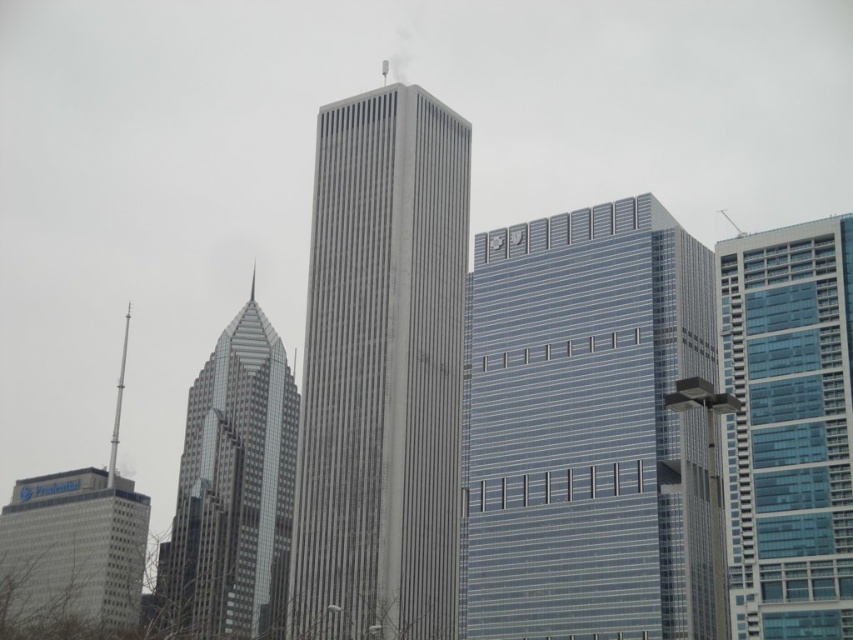
You are a drone operator who needs to fly a drone between the glassy silver skyscraper at left and the gray concrete building at lower left. The drone has a wingspan of 1.2 meters. Can the drone safely navigate the space between them?

The distance between the glassy silver skyscraper at left and the gray concrete building at lower left is 15.00 meters, which is more than enough for the drone with a wingspan of 1.2 meters to safely navigate between them.

You are an architect analyzing the cityscape. You need to determine the spatial relationship between the gray concrete skyscraper at center and the glassy silver skyscraper at left. Based on the image, which skyscraper appears higher in the visual field?

The gray concrete skyscraper at center is located above the glassy silver skyscraper at left, so it appears higher in the visual field.

You are a drone operator planning to fly a drone between the gray concrete skyscraper at center and the glassy silver skyscraper at left. According to the image, which skyscraper is closer to you, making it the first one the drone would encounter?

The gray concrete skyscraper at center is in front of the glassy silver skyscraper at left, so the drone would first encounter the gray concrete skyscraper at center since it is closer to you.